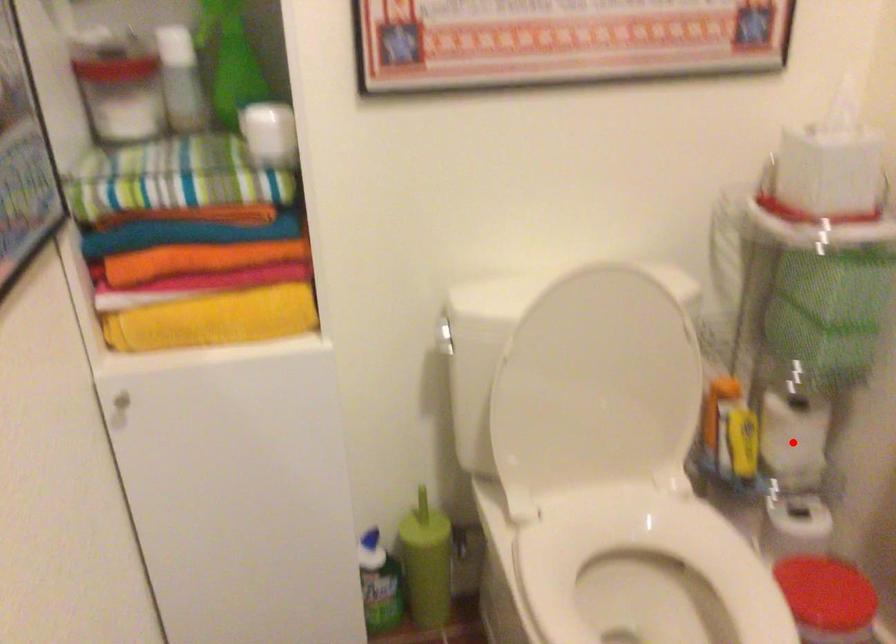
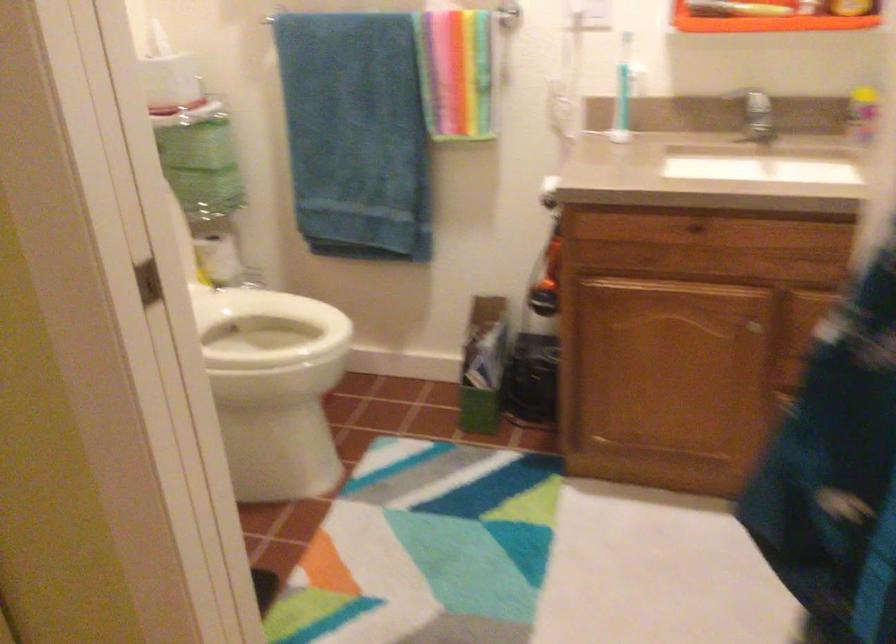
In the second image, find the point that corresponds to the highlighted location in the first image.

(219, 259)